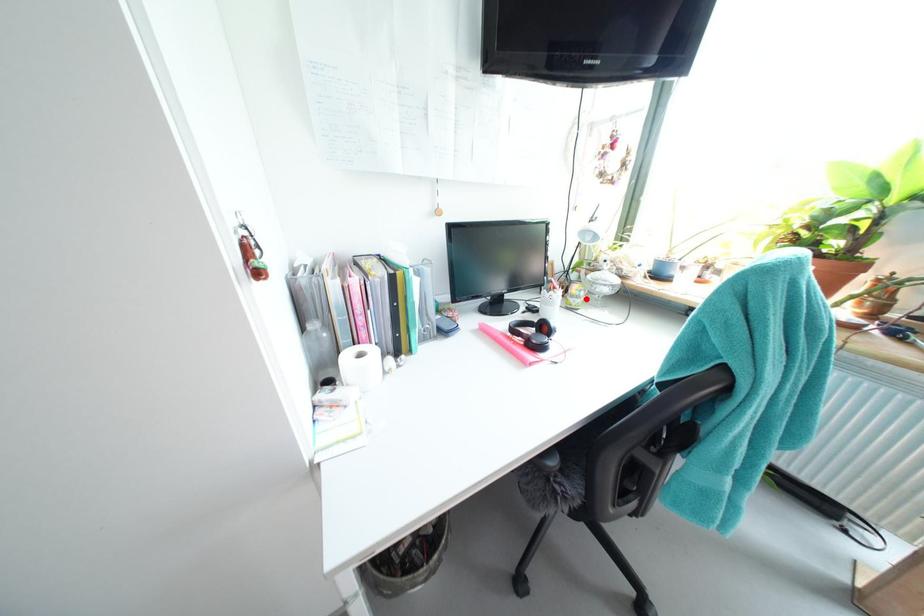
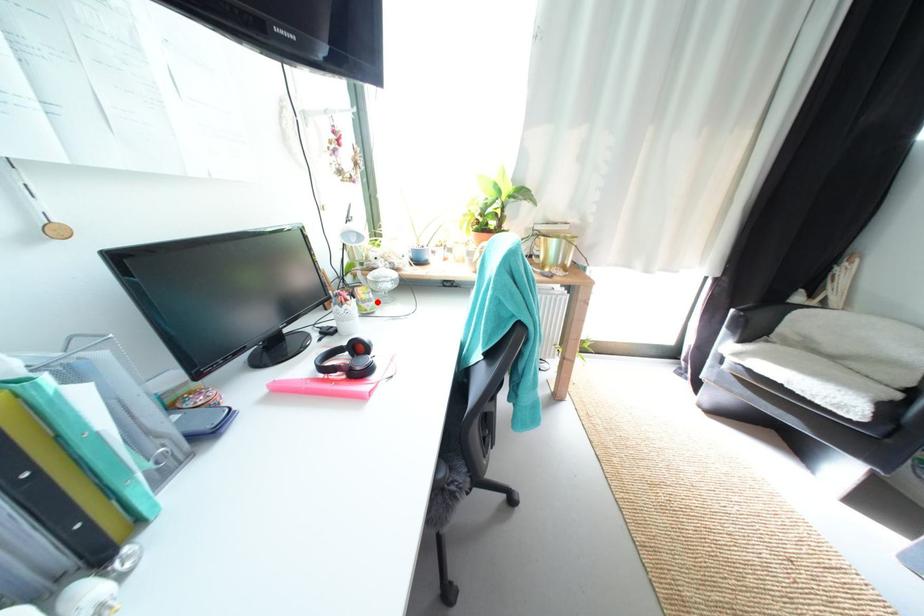
I am providing you with two images of the same scene from different viewpoints. A red point is marked on the first image and another point is marked on the second image. Do the highlighted points in image1 and image2 indicate the same real-world spot?

Yes